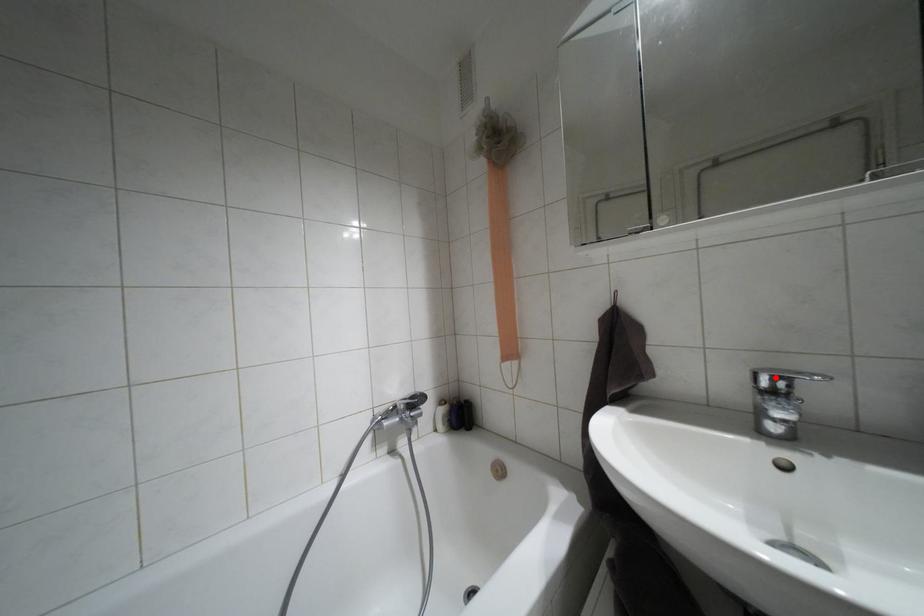
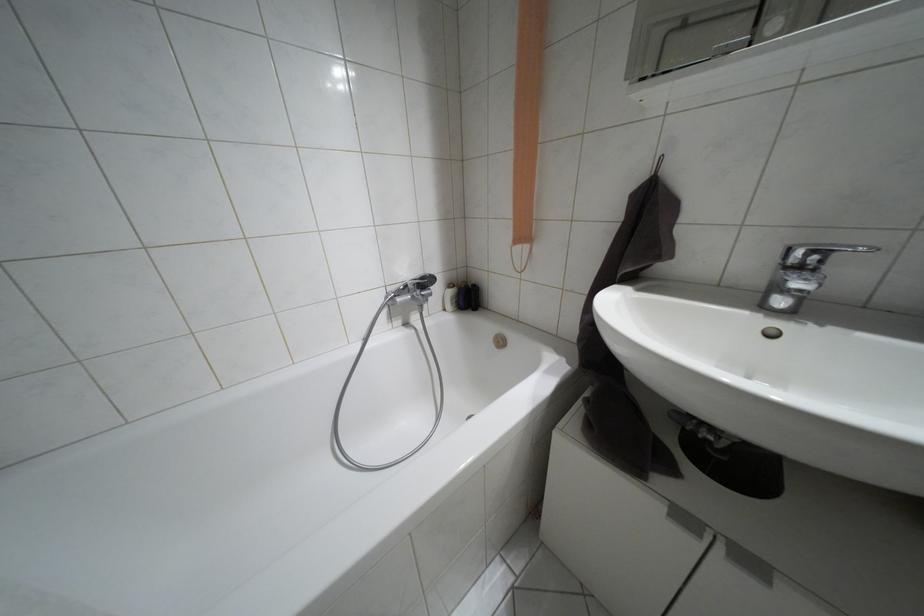
The point at the highlighted location is marked in the first image. Where is the corresponding point in the second image?

(810, 253)